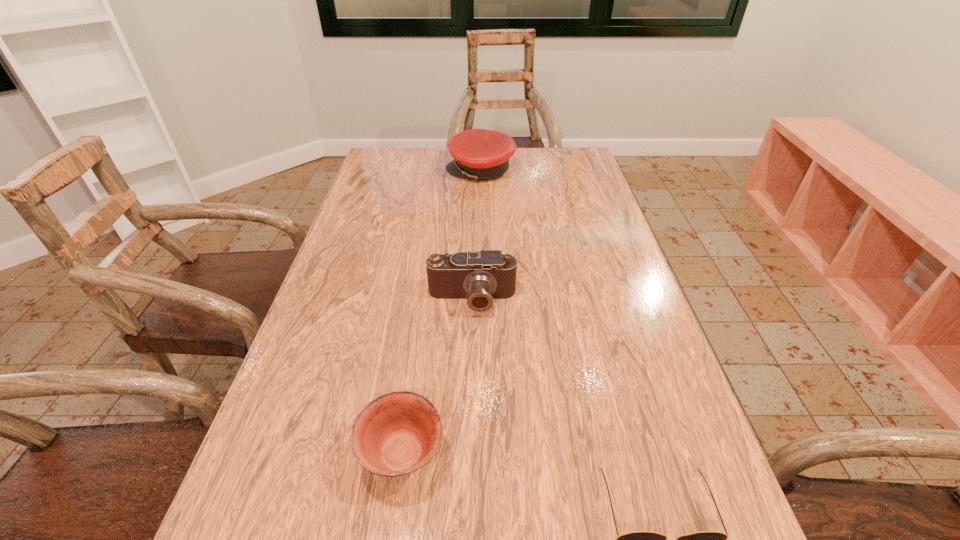
I want to click on free spot that satisfies the following two spatial constraints: 1. on the front of the farthest object with an emblem; 2. on the front-facing side of the third nearest object, so 481,300.

In order to click on vacant space that satisfies the following two spatial constraints: 1. on the front of the cap with an emblem; 2. on the front-facing side of the second farthest object in this screenshot , I will do coord(481,300).